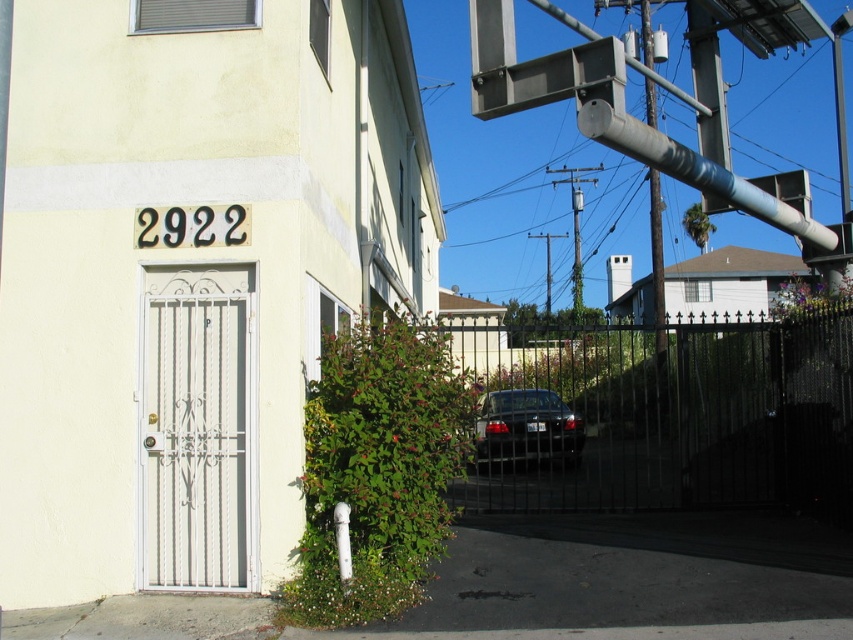
You are a delivery person trying to enter the driveway through the black wrought iron gate at center. The shiny black sedan at center is parked behind the gate. Can you drive your truck through the gate without hitting the sedan?

The black wrought iron gate at center might be wider than the shiny black sedan at center, so there is a possibility that the truck can pass through without hitting the sedan. However, the exact width difference isn not specified, so caution is advised.

You are a delivery driver approaching the entrance of 2922. You see the black wrought iron gate at center and the shiny black sedan at center. Can you drive through the gate without hitting the sedan?

The black wrought iron gate at center is in front of the shiny black sedan at center, so the sedan is behind the gate. Therefore, you can drive through the gate without hitting the sedan as it is positioned behind the gate.